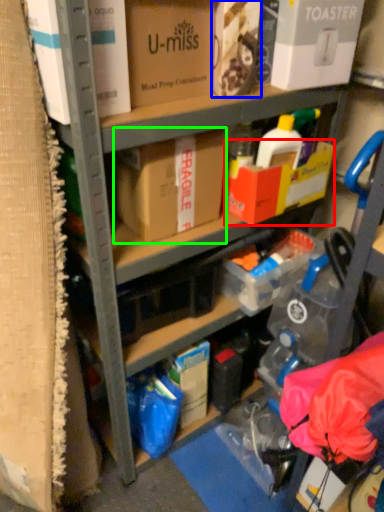
Question: Which object is positioned farthest from box (highlighted by a red box)? Select from box (highlighted by a blue box) and box (highlighted by a green box).

Choices:
 (A) box
 (B) box

Answer: (A)